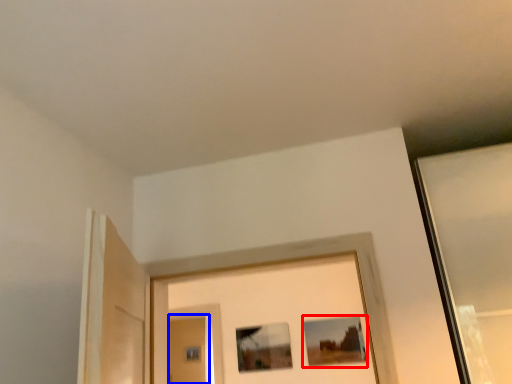
Question: Which of the following is the farthest to the observer, picture frame (highlighted by a red box) or screen door (highlighted by a blue box)?

Choices:
 (A) picture frame
 (B) screen door

Answer: (B)